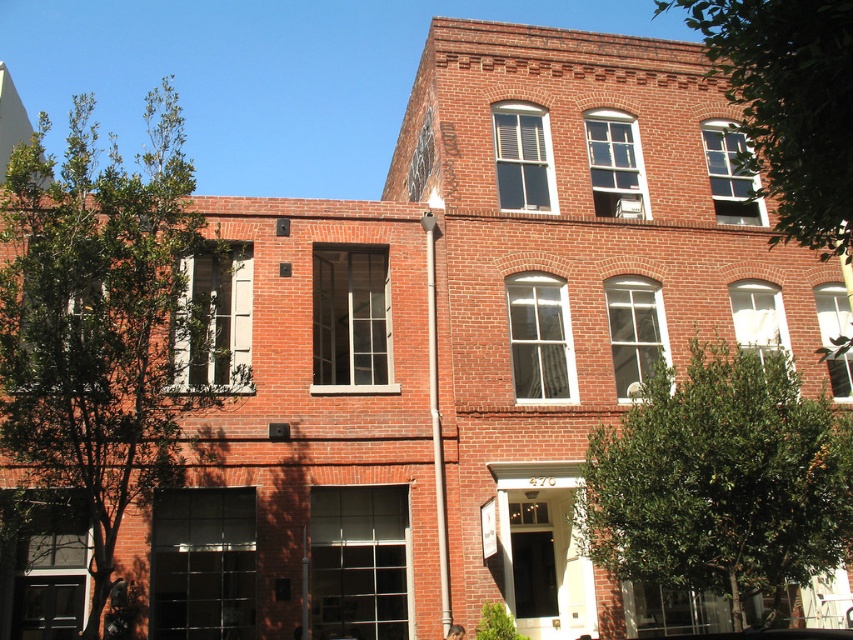
Can you confirm if green leafy tree at center is positioned to the left of green leafy tree at upper right?

Indeed, green leafy tree at center is positioned on the left side of green leafy tree at upper right.

Which is more to the left, green leafy tree at center or green leafy tree at upper right?

green leafy tree at center is more to the left.

Is point (721, 538) positioned in front of point (738, 161)?

That is False.

Identify the location of green leafy tree at center. This screenshot has width=853, height=640. (720, 480).

Can you confirm if green leafy tree at left is positioned below green leafy tree at center?

No.

Does green leafy tree at left have a lesser height compared to green leafy tree at center?

No.

Is point (132, 252) closer to camera compared to point (831, 509)?

Yes, it is in front of point (831, 509).

The image size is (853, 640). I want to click on green leafy tree at left, so click(x=97, y=332).

Is green leafy tree at left wider than green leafy tree at upper right?

Indeed, green leafy tree at left has a greater width compared to green leafy tree at upper right.

Between point (80, 417) and point (755, 115), which one is positioned behind?

Positioned behind is point (80, 417).

Identify the location of green leafy tree at left. (97, 332).